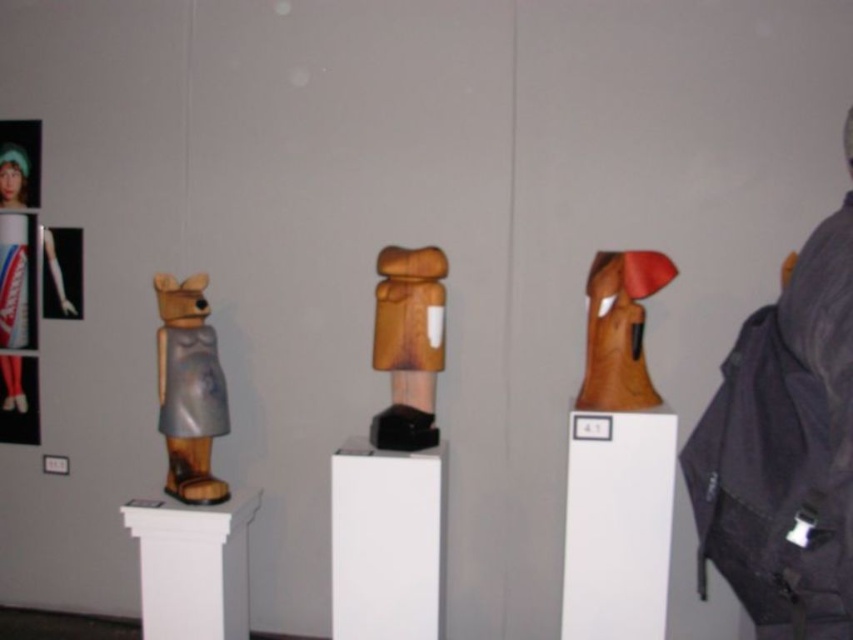
You are an art curator planning to move the metallic silver dress at left closer to the entrance. To do this, you need to pass behind the wooden statue at center. Is this possible given their current positions?

The wooden statue at center is in front of the metallic silver dress at left, so you can move behind the wooden statue at center to access the metallic silver dress at left.

You are standing in the art gallery and want to locate the wooden statue at center. According to the coordinates provided, where should you look to find it?

You should look at point (408,344) to find the wooden statue at center.